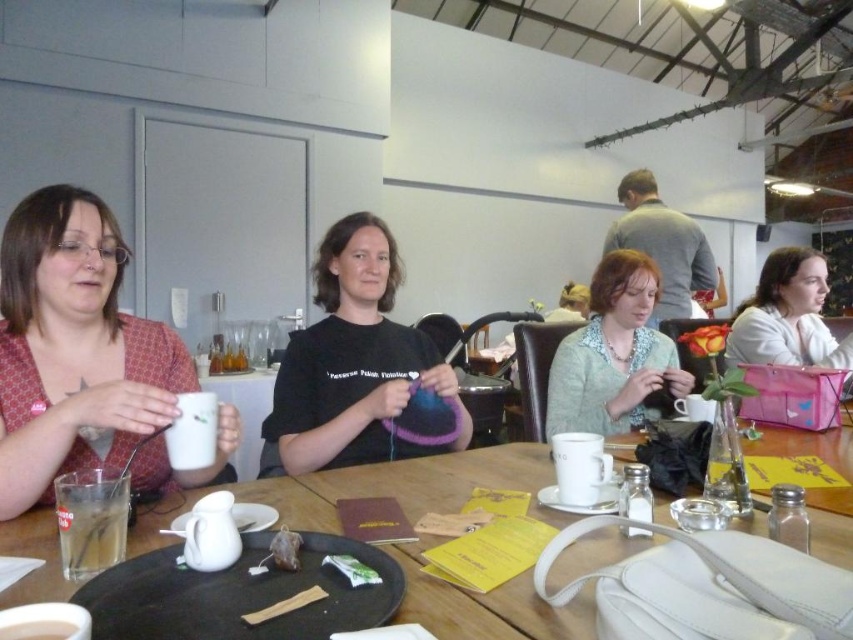
You are trying to place a small teacup on the table without disturbing the light green knitwear at center. Where should you place it?

The light green knitwear at center is located at coordinates point (613, 355), so you should place the teacup in an area of the table that does not overlap with this position.

You are a guest at this gathering and want to place a small item on the table without moving anything. Which object, the light green knitwear at center or the translucent glass cup at lower left, is closer to you so you can place it there?

The light green knitwear at center is closer to you than the translucent glass cup at lower left, so you can place the item there without moving anything.